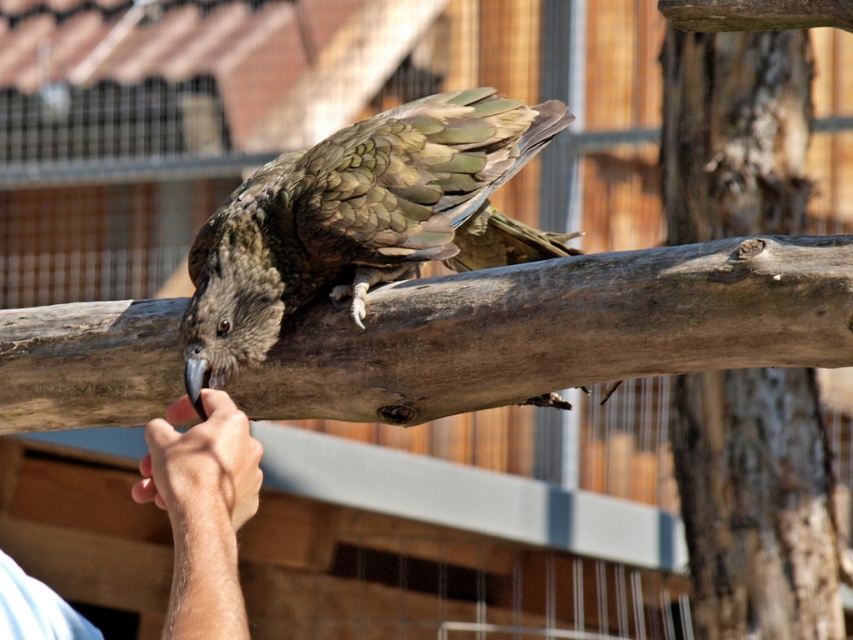
Question: Which is farther from the light skin hand at lower left?

Choices:
 (A) brown rough wood at center
 (B) greenish-brown feathered bird at center

Answer: (A)

Question: Can you confirm if brown rough wood at center is positioned to the right of light skin hand at lower left?

Choices:
 (A) no
 (B) yes

Answer: (B)

Question: Does smooth brown log at center appear over light skin hand at lower left?

Choices:
 (A) no
 (B) yes

Answer: (B)

Question: Which point is farther from the camera taking this photo?

Choices:
 (A) (384, 140)
 (B) (817, 493)

Answer: (B)

Question: Which of the following is the closest to the observer?

Choices:
 (A) (798, 168)
 (B) (793, 364)
 (C) (398, 140)
 (D) (219, 628)

Answer: (D)

Question: Is smooth brown log at center closer to camera compared to light skin hand at lower left?

Choices:
 (A) yes
 (B) no

Answer: (B)